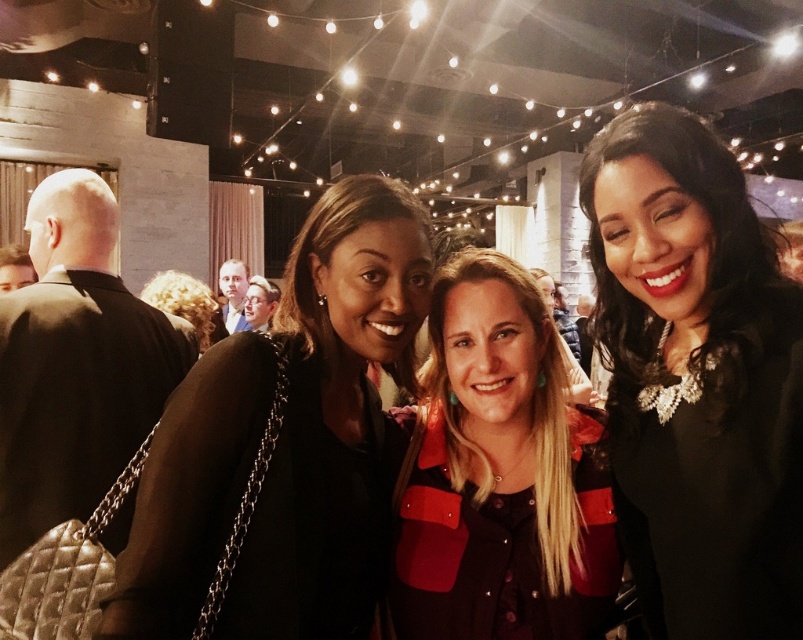
You are a photographer at the event and want to ensure that the black shiny necklace at upper right and the matte black jacket at center are both visible in the photo. Given their sizes, which object might require you to zoom in more to capture details?

The black shiny necklace at upper right is thinner than the matte black jacket at center, so you might need to zoom in more on the black shiny necklace at upper right to capture its details.

You are at a party and want to hand a gift to the person wearing the matte black jacket at left. You are currently standing 20 feet away from them. Can you throw the gift directly to them without it going past them?

The distance between you and the matte black jacket at left is 20 feet, but the objects description states they are 31.88 inches apart. This seems contradictory. Please clarify the distance.

You are at a party and want to find the black shiny necklace at upper right. According to the scene, where exactly is it positioned?

The black shiny necklace at upper right is located at point 0.594 on the horizontal axis and 0.868 on the vertical axis.